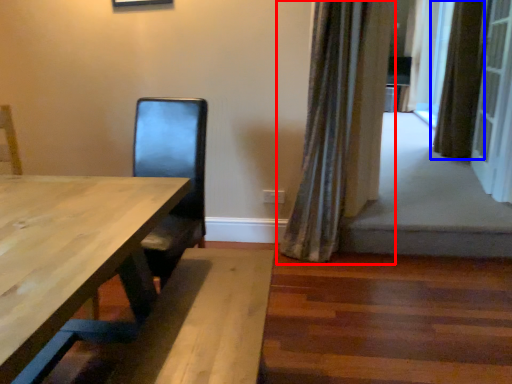
Question: Which of the following is the closest to the observer, curtain (highlighted by a red box) or curtain (highlighted by a blue box)?

Choices:
 (A) curtain
 (B) curtain

Answer: (A)